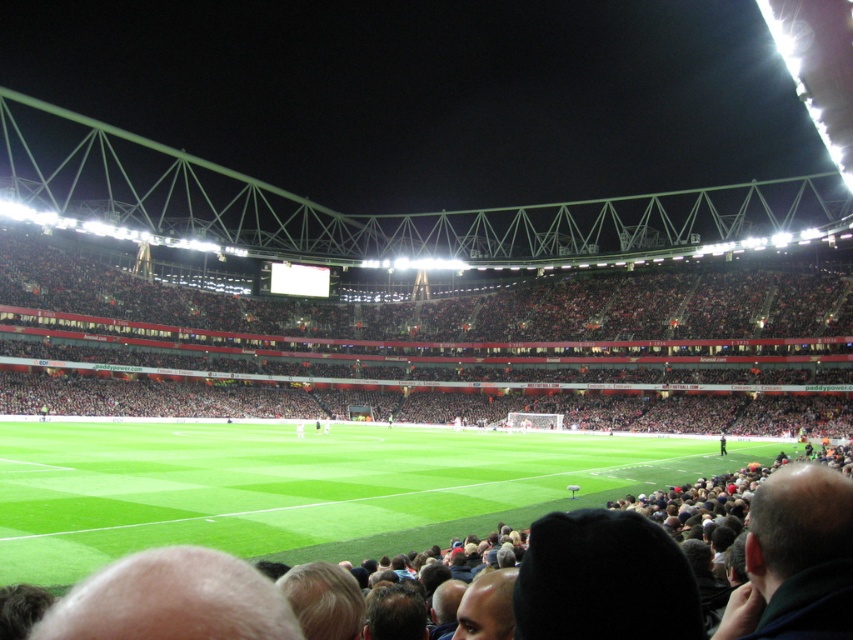
This screenshot has height=640, width=853. Describe the element at coordinates (305, 486) in the screenshot. I see `green grass at center` at that location.

Is green grass at center shorter than dark red seats at center?

Yes.

Who is more forward, (474, 477) or (688, 378)?

Point (474, 477) is in front.

You are a GUI agent. You are given a task and a screenshot of the screen. Output one action in this format:
    pyautogui.click(x=<x>, y=<y>)
    Task: Click on the green grass at center
    
    Given the screenshot: What is the action you would take?
    pyautogui.click(x=305, y=486)